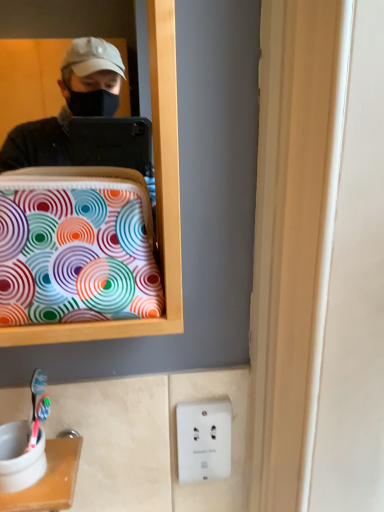
Question: Should I look upward or downward to see colorful fabric bag at left?

Choices:
 (A) up
 (B) down

Answer: (A)

Question: Does white plastic electric outlet at lower center have a greater width compared to colorful fabric bag at left?

Choices:
 (A) no
 (B) yes

Answer: (A)

Question: Considering the relative positions of white plastic electric outlet at lower center and colorful fabric bag at left in the image provided, is white plastic electric outlet at lower center to the left of colorful fabric bag at left from the viewer's perspective?

Choices:
 (A) no
 (B) yes

Answer: (A)

Question: Is white plastic electric outlet at lower center next to colorful fabric bag at left?

Choices:
 (A) no
 (B) yes

Answer: (A)

Question: Can you confirm if white plastic electric outlet at lower center is shorter than colorful fabric bag at left?

Choices:
 (A) no
 (B) yes

Answer: (B)

Question: Is white plastic electric outlet at lower center smaller than colorful fabric bag at left?

Choices:
 (A) yes
 (B) no

Answer: (A)

Question: Considering the relative sizes of white plastic electric outlet at lower center and colorful fabric bag at left in the image provided, is white plastic electric outlet at lower center taller than colorful fabric bag at left?

Choices:
 (A) no
 (B) yes

Answer: (A)

Question: Is white plastic toothbrush holder at lower left oriented away from colorful fabric bag at left?

Choices:
 (A) no
 (B) yes

Answer: (A)

Question: Does white plastic toothbrush holder at lower left appear on the right side of colorful fabric bag at left?

Choices:
 (A) no
 (B) yes

Answer: (A)

Question: Is white plastic toothbrush holder at lower left not close to colorful fabric bag at left?

Choices:
 (A) yes
 (B) no

Answer: (B)

Question: From the image's perspective, is white plastic toothbrush holder at lower left on top of colorful fabric bag at left?

Choices:
 (A) yes
 (B) no

Answer: (B)

Question: Is colorful fabric bag at left located within white plastic toothbrush holder at lower left?

Choices:
 (A) yes
 (B) no

Answer: (B)

Question: Does white plastic toothbrush holder at lower left have a lesser height compared to colorful fabric bag at left?

Choices:
 (A) no
 (B) yes

Answer: (B)

Question: Could you tell me if colorful fabric bag at left is facing white plastic toothbrush holder at lower left?

Choices:
 (A) no
 (B) yes

Answer: (A)